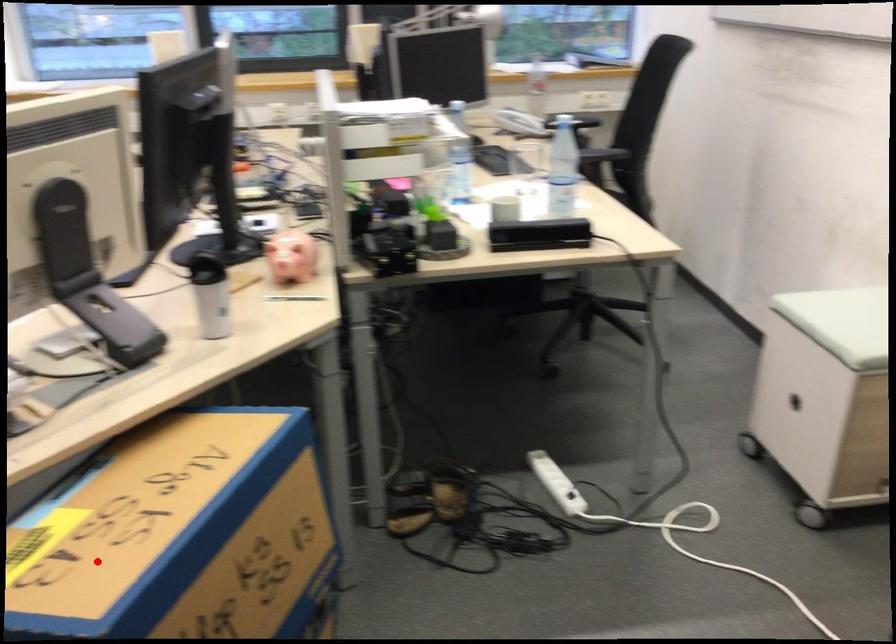
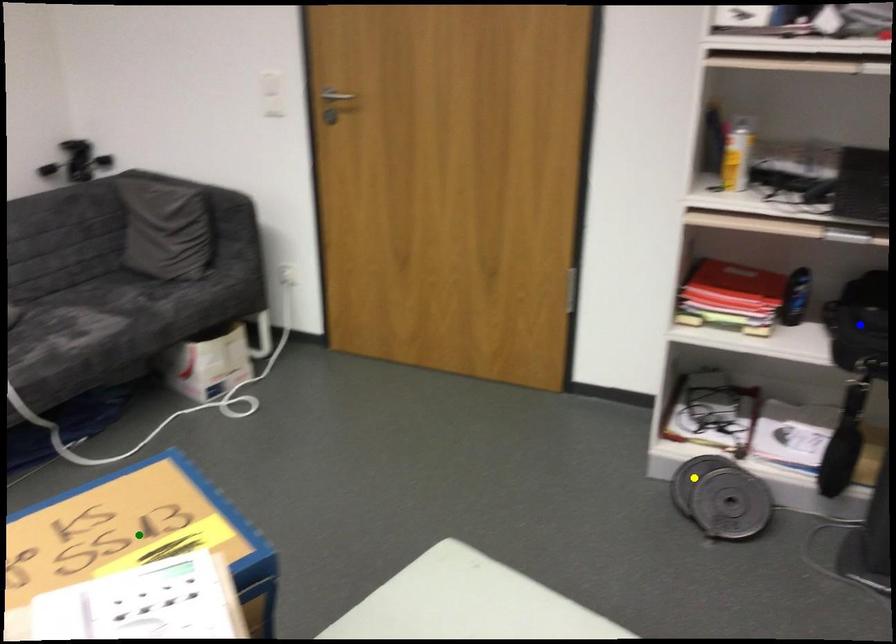
Question: I am providing you with two images of the same scene from different viewpoints. A red point is marked on the first image. You are given multiple points on the second image. Can you choose the point in image 2 that corresponds to the point in image 1?

Choices:
 (A) yellow point
 (B) green point
 (C) blue point

Answer: (B)